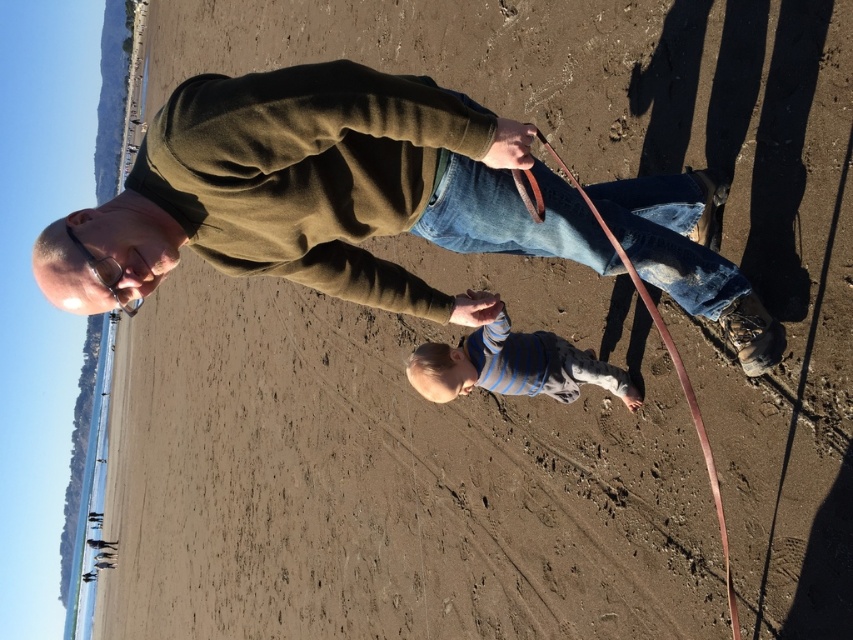
You are a photographer trying to capture a closeup of the brown leather leash at lower center without the matte green sweater at upper center blocking the view. Based on their sizes, can you fit the entire leash into the frame while keeping the sweater out of the shot?

The matte green sweater at upper center is bigger than the brown leather leash at lower center. Since the sweater is larger, it might be challenging to frame the leash without the sweater blocking part of the view. However, adjusting the camera angle or zoom could help isolate the leash while excluding the sweater.

Looking at this image, you are a photographer trying to capture a clear shot of the matte green sweater at upper center and the brown leather leash at lower center. Since the scene is crowded, you need to adjust your camera angle to ensure both objects are visible. Based on their positions, which object is closer to the camera and might block the view of the other?

The matte green sweater at upper center is in front of the brown leather leash at lower center, so it is closer to the camera and may block the view of the leash.